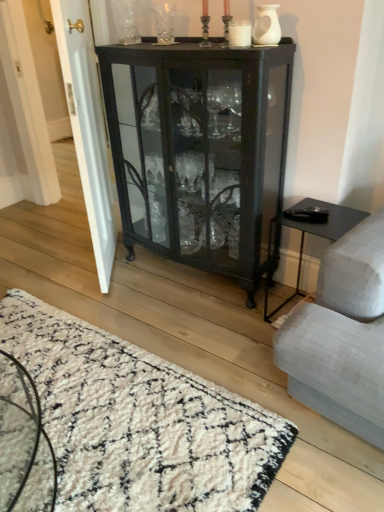
Question: Is black glass cabinet at center wider or thinner than clear glass vase at upper center, the 1th glass vase in the top-to-bottom sequence?

Choices:
 (A) thin
 (B) wide

Answer: (B)

Question: Is black glass cabinet at center bigger or smaller than clear glass vase at upper center, which ranks as the 1th glass vase in left-to-right order?

Choices:
 (A) big
 (B) small

Answer: (A)

Question: Which object is positioned closest to the white matte vase at upper center, which is the first glass vase in bottom-to-top order?

Choices:
 (A) black glass cabinet at center
 (B) white shaggy rug at lower left
 (C) clear glass vase at upper center, arranged as the first glass vase when viewed from the back
 (D) white glossy door at left

Answer: (A)

Question: Estimate the real-world distances between objects in this image. Which object is farther from the white shaggy rug at lower left?

Choices:
 (A) white glossy door at left
 (B) white matte vase at upper center, the second glass vase in the left-to-right sequence
 (C) black glass cabinet at center
 (D) clear glass vase at upper center, which ranks as the 1th glass vase in left-to-right order

Answer: (D)